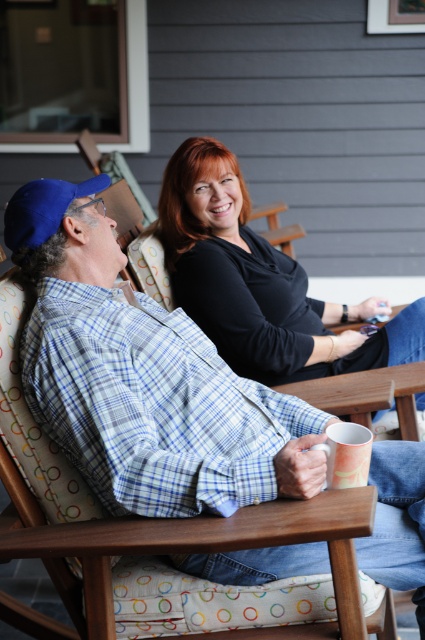
Does blue plaid shirt at upper left have a lesser width compared to black matte shirt at upper center?

In fact, blue plaid shirt at upper left might be wider than black matte shirt at upper center.

Can you confirm if blue plaid shirt at upper left is shorter than black matte shirt at upper center?

Incorrect, blue plaid shirt at upper left's height does not fall short of black matte shirt at upper center's.

Between point (149, 372) and point (368, 369), which one is positioned behind?

The point (368, 369) is behind.

This screenshot has height=640, width=425. Identify the location of blue plaid shirt at upper left. (144, 378).